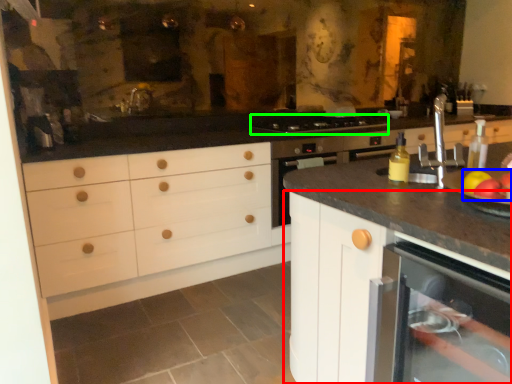
Question: Based on their relative distances, which object is nearer to cabinetry (highlighted by a red box)? Choose from apple (highlighted by a blue box) and gas stove (highlighted by a green box).

Choices:
 (A) apple
 (B) gas stove

Answer: (A)